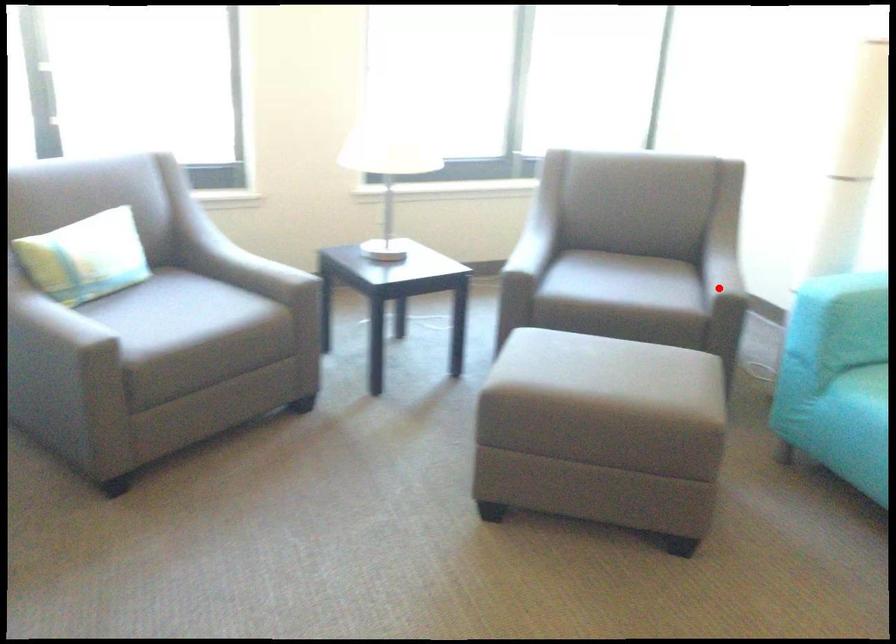
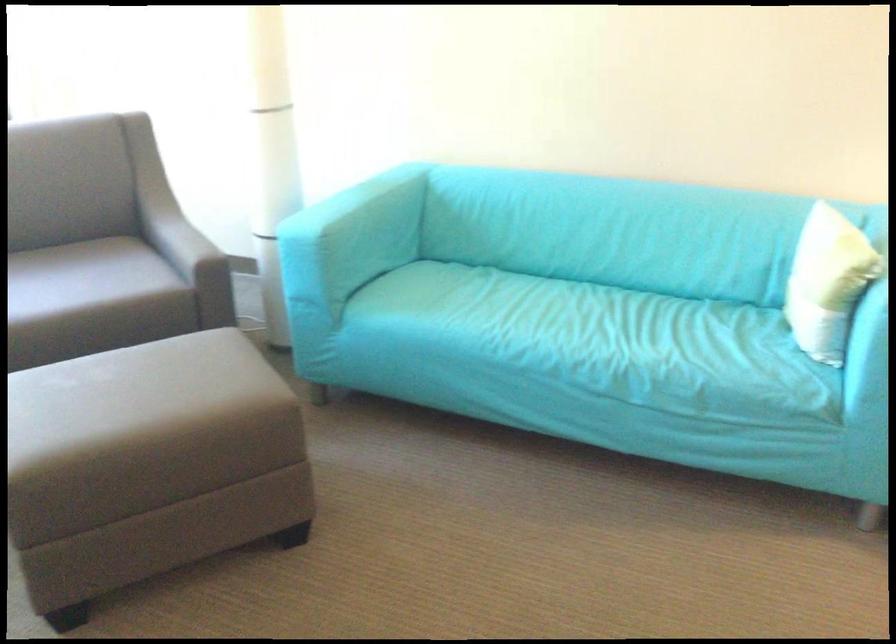
Question: I am providing you with two images of the same scene from different viewpoints. In image1, a red point is highlighted. Considering the same 3D point in image2, which of the following is correct?

Choices:
 (A) It is closer
 (B) It is farther

Answer: (A)